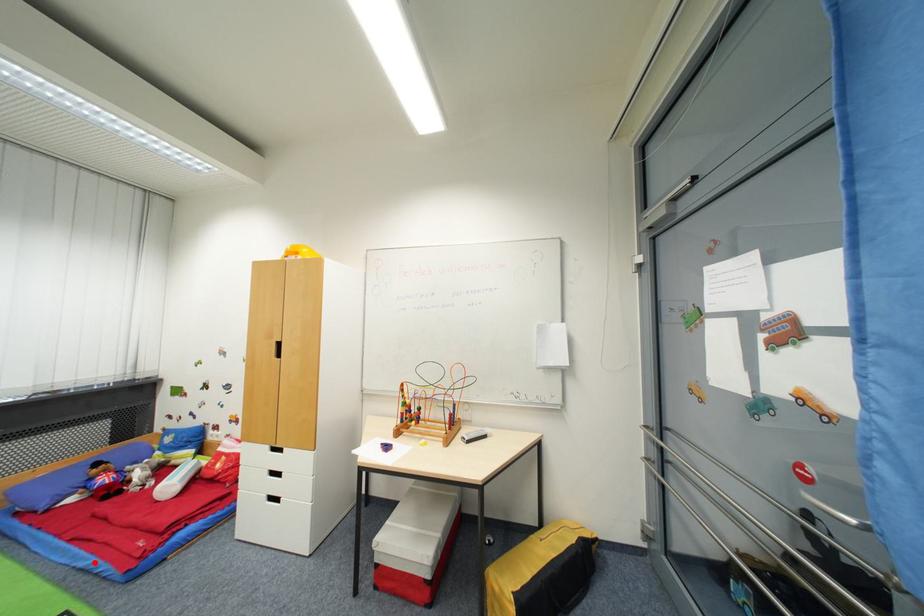
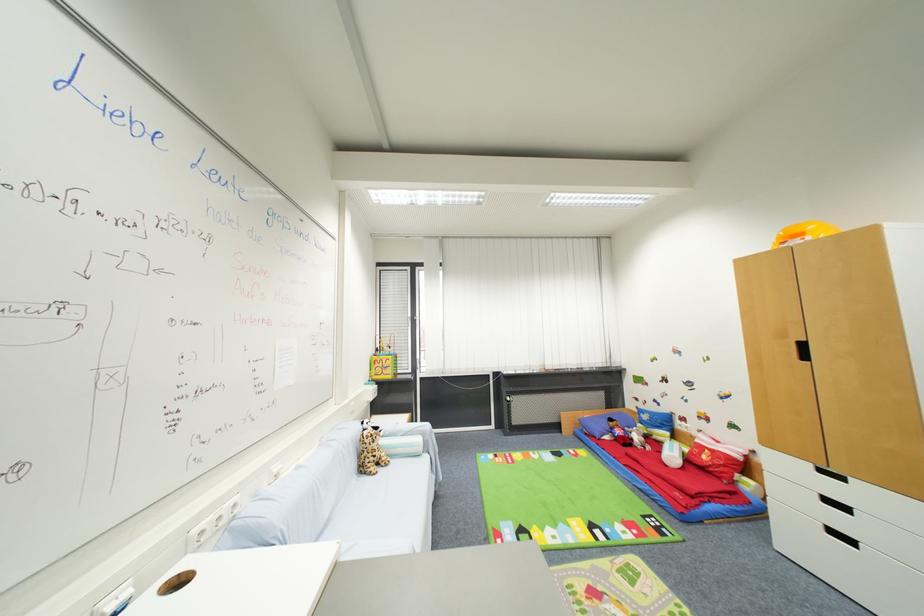
Where in the second image is the point corresponding to the highlighted location from the first image?

(650, 488)